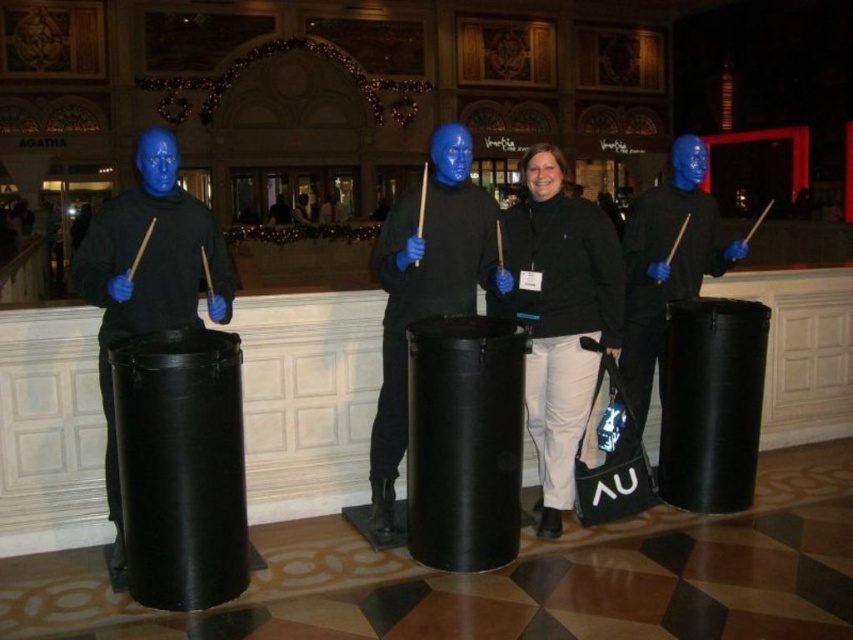
Does black matte jacket at center have a lesser height compared to matte black drum at left?

Yes.

Is black matte jacket at center below matte black drum at left?

No, black matte jacket at center is not below matte black drum at left.

Is point (566, 440) positioned behind point (141, 225)?

That is True.

Where is `black matte jacket at center`? This screenshot has width=853, height=640. black matte jacket at center is located at coordinates (560, 316).

Where is `black matte jacket at center`? black matte jacket at center is located at coordinates [x=560, y=316].

This screenshot has width=853, height=640. In order to click on black matte jacket at center in this screenshot , I will do `click(560, 316)`.

You are a GUI agent. You are given a task and a screenshot of the screen. Output one action in this format:
    pyautogui.click(x=<x>, y=<y>)
    Task: Click on the black matte jacket at center
    This screenshot has width=853, height=640.
    Given the screenshot: What is the action you would take?
    pyautogui.click(x=560, y=316)

Can you confirm if matte black drum at left is thinner than matte black drum at center?

No, matte black drum at left is not thinner than matte black drum at center.

I want to click on matte black drum at left, so click(148, 275).

Locate an element on the screen. The height and width of the screenshot is (640, 853). matte black drum at left is located at coordinates (148, 275).